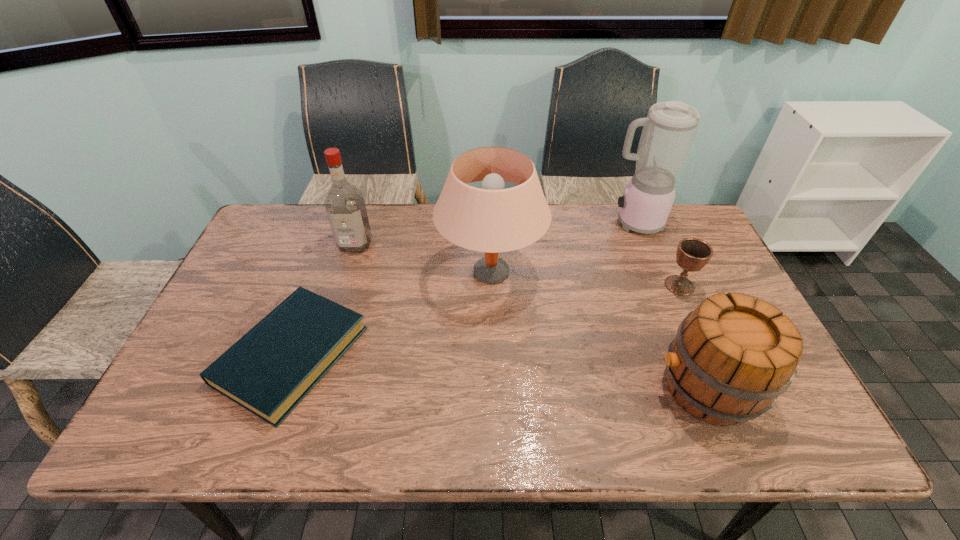
Locate an element on the screen. This screenshot has width=960, height=540. liquor present at the far edge is located at coordinates (345, 207).

At what (x,y) coordinates should I click in order to perform the action: click on cider present at the near edge. Please return your answer as a coordinate pair (x, y). This screenshot has width=960, height=540. Looking at the image, I should click on pyautogui.click(x=732, y=356).

The height and width of the screenshot is (540, 960). In order to click on book positioned at the near edge in this screenshot , I will do `click(268, 371)`.

Find the location of a particular element. Image resolution: width=960 pixels, height=540 pixels. object at the left edge is located at coordinates (268, 371).

The height and width of the screenshot is (540, 960). I want to click on food processor located at the right edge, so click(669, 130).

Image resolution: width=960 pixels, height=540 pixels. Find the location of `cider that is at the right edge`. cider that is at the right edge is located at coordinates (732, 356).

I want to click on chalice that is at the right edge, so click(x=692, y=254).

The width and height of the screenshot is (960, 540). I want to click on object present at the near left corner, so click(268, 371).

This screenshot has height=540, width=960. In order to click on object situated at the far right corner in this screenshot , I will do `click(669, 130)`.

You are a GUI agent. You are given a task and a screenshot of the screen. Output one action in this format:
    pyautogui.click(x=<x>, y=<y>)
    Task: Click on the object present at the near right corner
    
    Given the screenshot: What is the action you would take?
    pyautogui.click(x=732, y=356)